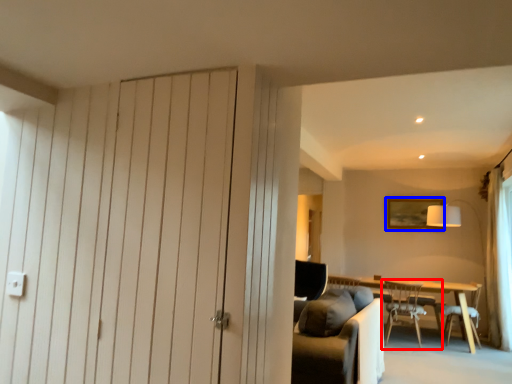
Question: Which of the following is the farthest to the observer, chair (highlighted by a red box) or picture frame (highlighted by a blue box)?

Choices:
 (A) chair
 (B) picture frame

Answer: (B)